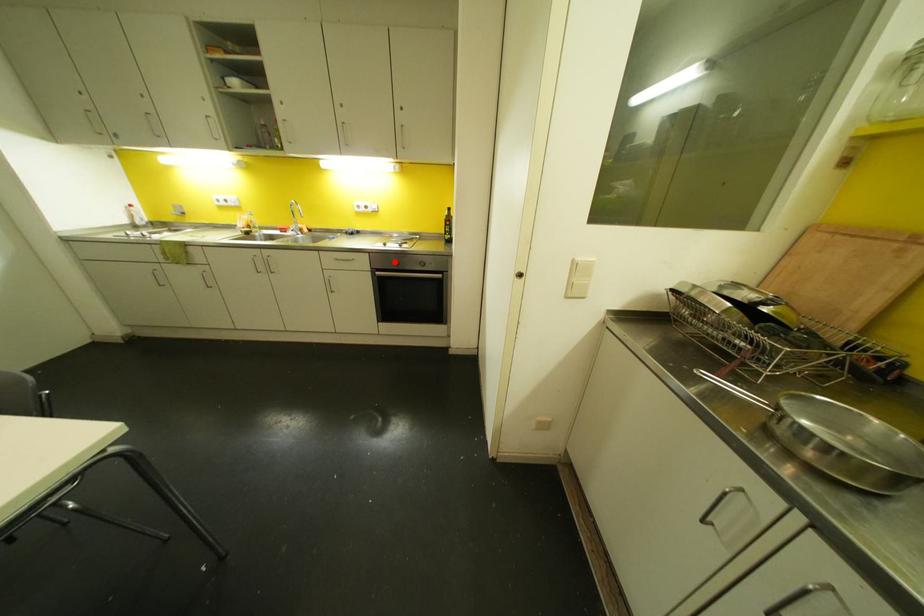
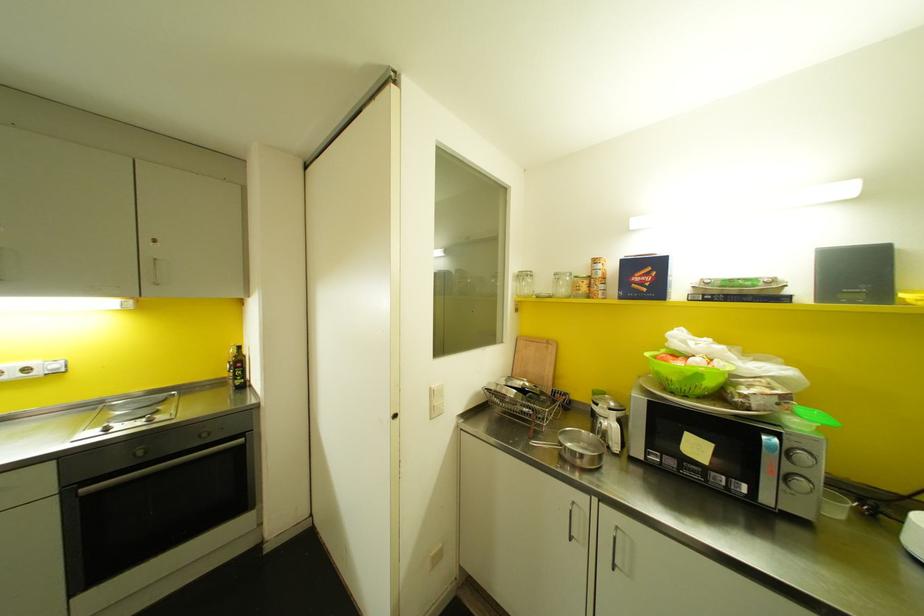
Question: I am providing you with two images of the same scene from different viewpoints. A red point is shown in image1. For the corresponding object point in image2, is it positioned nearer or farther from the camera?

Choices:
 (A) Nearer
 (B) Farther

Answer: (B)